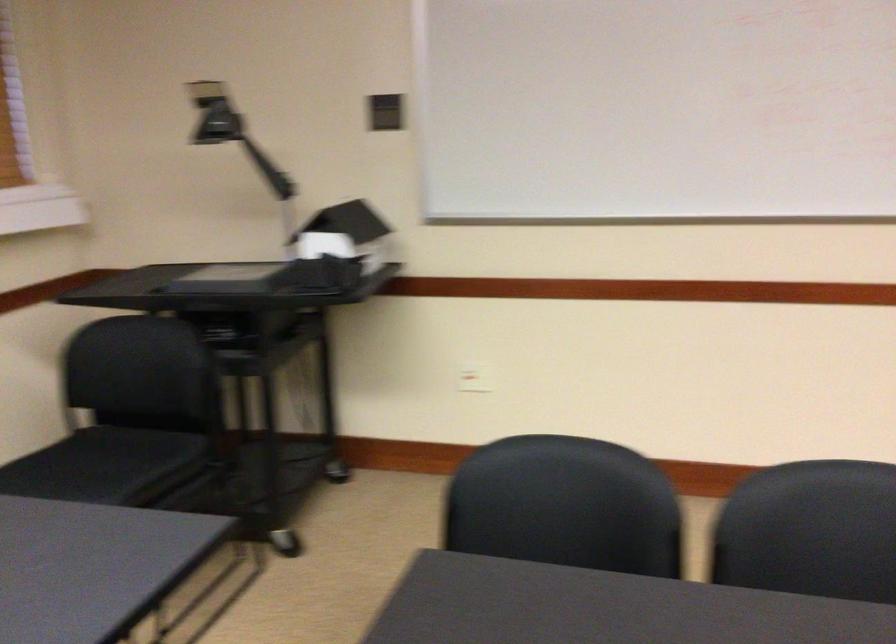
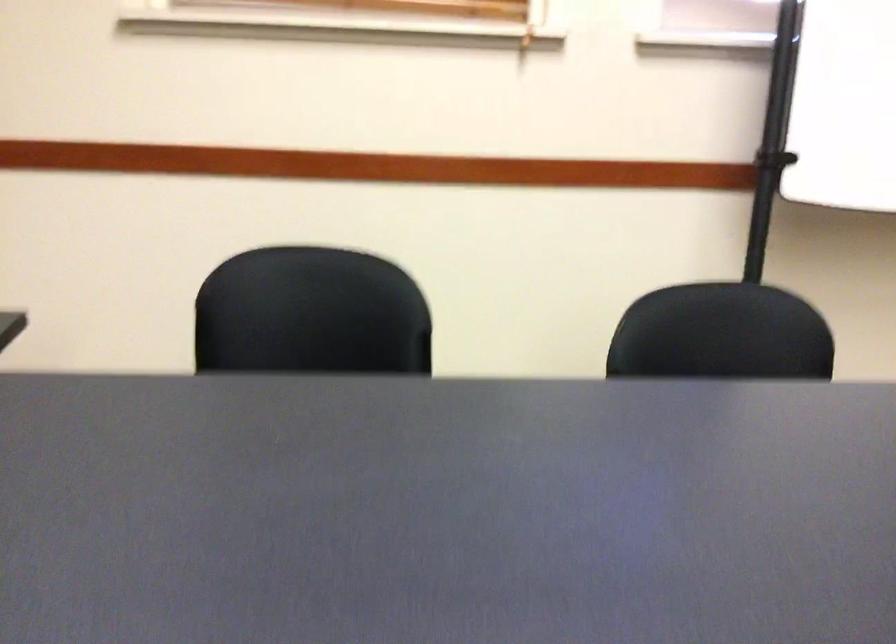
First-person continuous shooting, in which direction is the camera rotating?

The rotation direction of the camera is left-down.